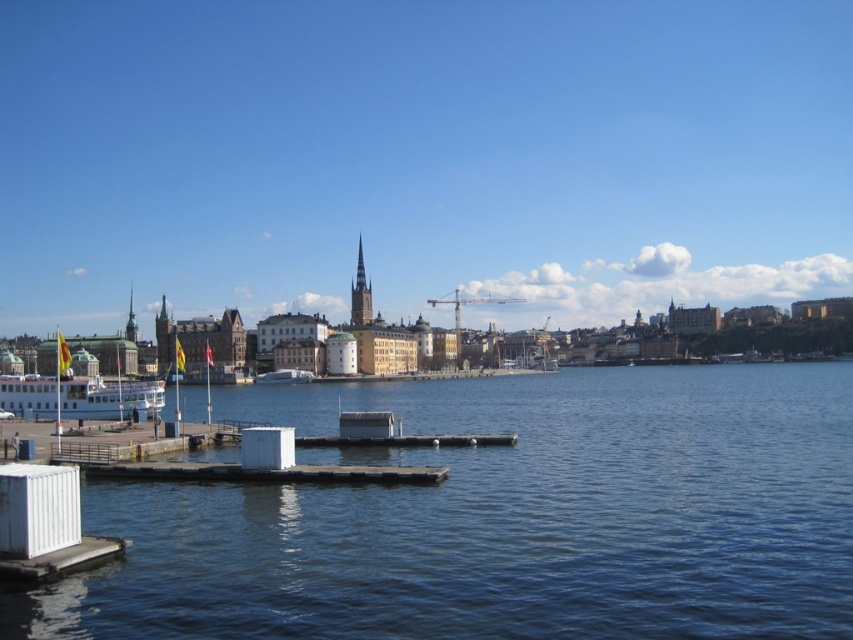
Can you confirm if transparent water at lower left is bigger than white glossy ferry at left?

Actually, transparent water at lower left might be smaller than white glossy ferry at left.

Who is more forward, (828, 486) or (20, 406)?

Positioned in front is point (828, 486).

At what (x,y) coordinates should I click in order to perform the action: click on transparent water at lower left. Please return your answer as a coordinate pair (x, y). The image size is (853, 640). Looking at the image, I should click on (502, 516).

Measure the distance between point (86,342) and camera.

They are 176.69 meters apart.

Locate an element on the screen. white glossy ferry at left is located at coordinates (80, 388).

Does white glossy ferry at left appear under smooth stone spire at center?

Indeed, white glossy ferry at left is positioned under smooth stone spire at center.

Which is in front, point (74, 358) or point (357, 269)?

Point (74, 358) is in front.

Find the location of a particular element. This screenshot has height=640, width=853. white glossy ferry at left is located at coordinates (80, 388).